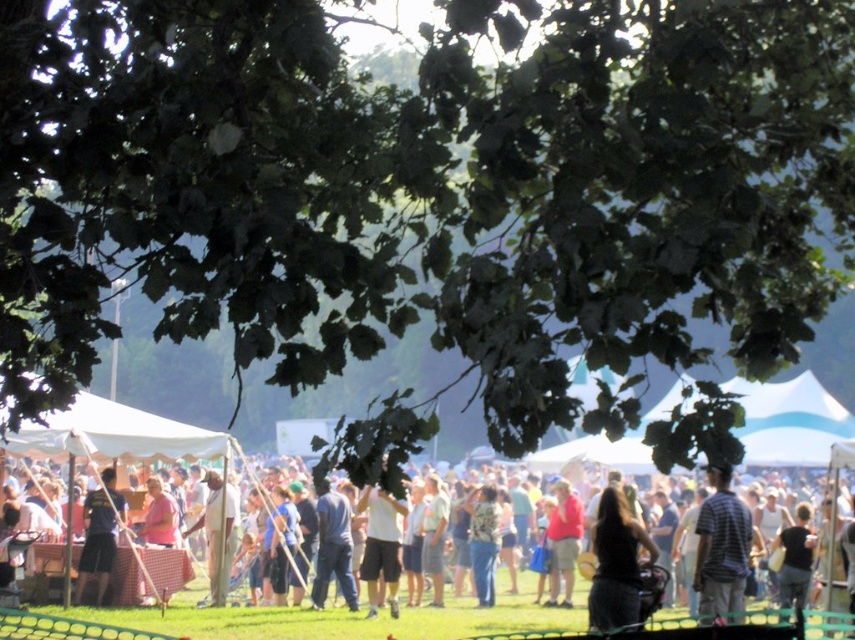
You are at a festival and want to find a spot to place a small table. You notice there is a white matte shirt at center located at point [381,545]. Is there enough space around the white matte shirt at center to place the table without it being too close to the shirt?

The answer is yes. Since the white matte shirt at center is at point [381,545], there is likely enough space around it to place a small table without being too close, as the description doesn

You are a photographer trying to capture a clear shot of the dark blue jeans at center and dark brown hair at center. Based on their heights, which object should you focus on first if you want to ensure both are in frame?

The dark blue jeans at center is taller than dark brown hair at center, so you should focus on the dark blue jeans at center first to ensure both are in frame.